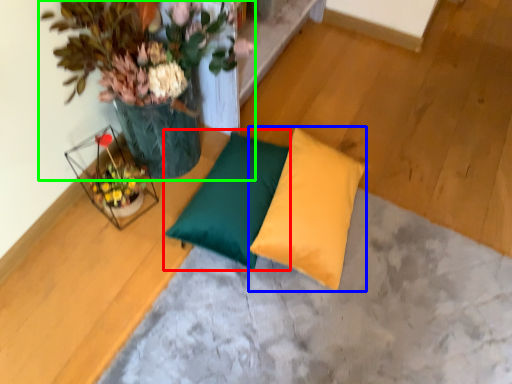
Question: Which object is positioned farthest from pillow (highlighted by a red box)? Select from pillow (highlighted by a blue box) and houseplant (highlighted by a green box).

Choices:
 (A) pillow
 (B) houseplant

Answer: (B)